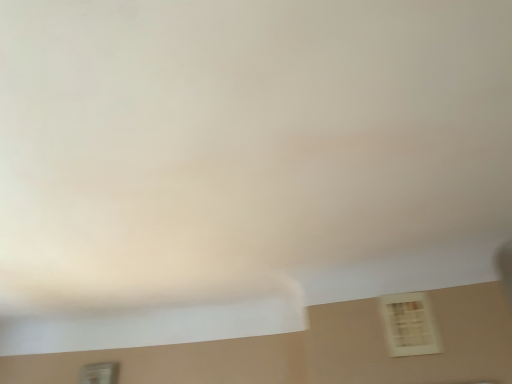
Question: Considering the positions of white plastic window at lower left, the 2th window when ordered from top to bottom, and white matte window at lower right, the 2th window positioned from the back, in the image, is white plastic window at lower left, the 2th window when ordered from top to bottom, taller or shorter than white matte window at lower right, the 2th window positioned from the back,?

Choices:
 (A) short
 (B) tall

Answer: (B)

Question: From the image's perspective, is white plastic window at lower left, which ranks as the first window in left-to-right order, above or below white matte window at lower right, which ranks as the 1th window in top-to-bottom order?

Choices:
 (A) above
 (B) below

Answer: (B)

Question: Is white plastic window at lower left, positioned as the first window in bottom-to-top order, bigger or smaller than white matte window at lower right, the 2th window positioned from the back?

Choices:
 (A) big
 (B) small

Answer: (A)

Question: In terms of height, does white matte window at lower right, acting as the 2th window starting from the left, look taller or shorter compared to white plastic window at lower left, the 2th window when ordered from top to bottom?

Choices:
 (A) short
 (B) tall

Answer: (A)

Question: Is white matte window at lower right, the first window positioned from the front, to the left or to the right of white plastic window at lower left, positioned as the first window in bottom-to-top order, in the image?

Choices:
 (A) left
 (B) right

Answer: (B)

Question: From a real-world perspective, is white matte window at lower right, which ranks as the 1th window in top-to-bottom order, physically located above or below white plastic window at lower left, the 2th window when ordered from top to bottom?

Choices:
 (A) below
 (B) above

Answer: (B)

Question: Considering the positions of point click(x=400, y=329) and point click(x=103, y=377), is point click(x=400, y=329) closer or farther from the camera than point click(x=103, y=377)?

Choices:
 (A) farther
 (B) closer

Answer: (B)